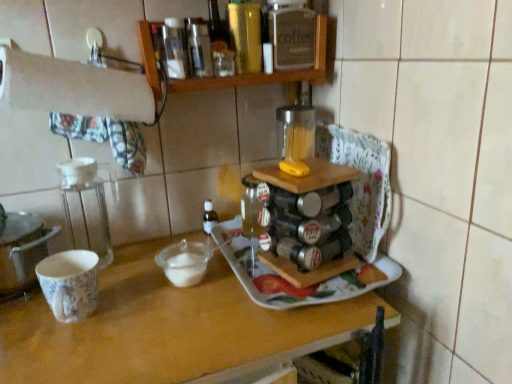
At what (x,y) coordinates should I click in order to perform the action: click on wooden spice rack at upper center. Please return your answer as a coordinate pair (x, y). Image resolution: width=512 pixels, height=384 pixels. Looking at the image, I should click on (274, 72).

In order to face wooden tray at center, should I rotate leftwards or rightwards?

Turn left by 9.223 degrees to look at wooden tray at center.

What do you see at coordinates (361, 182) in the screenshot?
I see `metallic silver spice rack at center` at bounding box center [361, 182].

What is the approximate height of transparent plastic container at left?

transparent plastic container at left is 26.55 centimeters in height.

I want to click on wooden spice rack at upper center, so click(x=274, y=72).

Which of these two, wooden tray at center or transparent plastic container at left, stands taller?

Standing taller between the two is wooden tray at center.

From a real-world perspective, is wooden tray at center located higher than transparent plastic container at left?

Actually, wooden tray at center is physically below transparent plastic container at left in the real world.

Does wooden tray at center come behind transparent plastic container at left?

No, wooden tray at center is in front of transparent plastic container at left.

From the image's perspective, is wooden tray at center above or below transparent plastic container at left?

wooden tray at center is situated lower than transparent plastic container at left in the image.

How far apart are wooden spice rack at upper center and white ceramic tray at center?

They are 16.92 inches apart.

From the image's perspective, relative to white ceramic tray at center, is wooden spice rack at upper center above or below?

wooden spice rack at upper center is above white ceramic tray at center.

From a real-world perspective, is wooden spice rack at upper center located higher than white ceramic tray at center?

Indeed, from a real-world perspective, wooden spice rack at upper center stands above white ceramic tray at center.

Does point (223, 84) appear closer or farther from the camera than point (345, 287)?

Clearly, point (223, 84) is more distant from the camera than point (345, 287).

In terms of height, does wooden tray at center look taller or shorter compared to metallic silver spice rack at center?

wooden tray at center is taller than metallic silver spice rack at center.

Is wooden tray at center completely or partially outside of metallic silver spice rack at center?

Yes, wooden tray at center is outside of metallic silver spice rack at center.

Is wooden tray at center looking in the opposite direction of metallic silver spice rack at center?

No, wooden tray at center is not facing away from metallic silver spice rack at center.

From the image's perspective, is wooden tray at center positioned above or below metallic silver spice rack at center?

wooden tray at center is situated lower than metallic silver spice rack at center in the image.

Considering the positions of objects transparent plastic container at left and metallic gold bottle at upper center in the image provided, who is behind, transparent plastic container at left or metallic gold bottle at upper center?

Positioned behind is metallic gold bottle at upper center.

From a real-world perspective, which is physically above, transparent plastic container at left or metallic gold bottle at upper center?

metallic gold bottle at upper center, from a real-world perspective.

Considering the sizes of objects transparent plastic container at left and metallic gold bottle at upper center in the image provided, who is thinner, transparent plastic container at left or metallic gold bottle at upper center?

transparent plastic container at left is thinner.

Is white ceramic tray at center next to transparent glass mixing bowl at center and touching it?

They are not placed beside each other.

Does white ceramic tray at center have a greater width compared to transparent glass mixing bowl at center?

Correct, the width of white ceramic tray at center exceeds that of transparent glass mixing bowl at center.

Which is more distant, (x=360, y=287) or (x=175, y=261)?

The point (x=175, y=261) is behind.

Between white paper towel at upper left and transparent glass mixing bowl at center, which one is positioned behind?

transparent glass mixing bowl at center.

Is transparent glass mixing bowl at center surrounded by white paper towel at upper left?

Definitely not — transparent glass mixing bowl at center is not inside white paper towel at upper left.

Which is more to the left, white paper towel at upper left or transparent glass mixing bowl at center?

From the viewer's perspective, white paper towel at upper left appears more on the left side.

Based on their sizes in the image, would you say white paper towel at upper left is bigger or smaller than transparent glass mixing bowl at center?

Clearly, white paper towel at upper left is larger in size than transparent glass mixing bowl at center.

Is porcelain floral mug at left further to camera compared to wooden tray at center?

Yes, the depth of porcelain floral mug at left is greater than that of wooden tray at center.

Can you tell me how much porcelain floral mug at left and wooden tray at center differ in facing direction?

1.4 degrees separate the facing orientations of porcelain floral mug at left and wooden tray at center.

Can you confirm if porcelain floral mug at left is wider than wooden tray at center?

In fact, porcelain floral mug at left might be narrower than wooden tray at center.

Locate an element on the screen. The width and height of the screenshot is (512, 384). mug lying above the wooden tray at center (from the image's perspective) is located at coordinates (70, 284).

Identify the location of table below the transparent plastic container at left (from the image's perspective). (169, 329).

Where is `tray that is in front of the wooden spice rack at upper center`? The image size is (512, 384). tray that is in front of the wooden spice rack at upper center is located at coordinates (288, 282).

Looking at the image, which one is located further to metallic silver spice rack at center, white ceramic tray at center or transparent glass mixing bowl at center?

Among the two, transparent glass mixing bowl at center is located further to metallic silver spice rack at center.

Considering their positions, is white paper towel at upper left positioned further to metallic silver spice rack at center than metallic gold bottle at upper center?

white paper towel at upper left lies further to metallic silver spice rack at center than the other object.

When comparing their distances from white ceramic tray at center, does metallic silver spice rack at center or porcelain floral mug at left seem closer?

Based on the image, metallic silver spice rack at center appears to be nearer to white ceramic tray at center.

Considering their positions, is transparent plastic container at left positioned further to wooden tray at center than metallic gold bottle at upper center?

The object further to wooden tray at center is metallic gold bottle at upper center.

Considering their positions, is white paper towel at upper left positioned closer to transparent plastic container at left than metallic silver spice rack at center?

Based on the image, white paper towel at upper left appears to be nearer to transparent plastic container at left.

When comparing their distances from transparent glass mixing bowl at center, does wooden tray at center or wooden spice rack at upper center seem closer?

wooden tray at center is positioned closer to the anchor transparent glass mixing bowl at center.

When comparing their distances from transparent plastic container at left, does wooden tray at center or porcelain floral mug at left seem further?

wooden tray at center.

Looking at the image, which one is located closer to metallic gold bottle at upper center, transparent plastic container at left or wooden spice rack at upper center?

The object closer to metallic gold bottle at upper center is wooden spice rack at upper center.

You are a GUI agent. You are given a task and a screenshot of the screen. Output one action in this format:
    pyautogui.click(x=<x>, y=<y>)
    Task: Click on the mixing bowl between metallic silver spice rack at center and wooden tray at center in the vertical direction
    The image size is (512, 384).
    Given the screenshot: What is the action you would take?
    click(x=184, y=262)

Locate an element on the screen. The width and height of the screenshot is (512, 384). wide between metallic gold bottle at upper center and white ceramic tray at center in the up-down direction is located at coordinates (361, 182).

Locate an element on the screen. shelf between transparent plastic container at left and metallic silver spice rack at center in the horizontal direction is located at coordinates (274, 72).

Identify the location of towel bar between metallic gold bottle at upper center and transparent glass mixing bowl at center in the vertical direction. (74, 88).